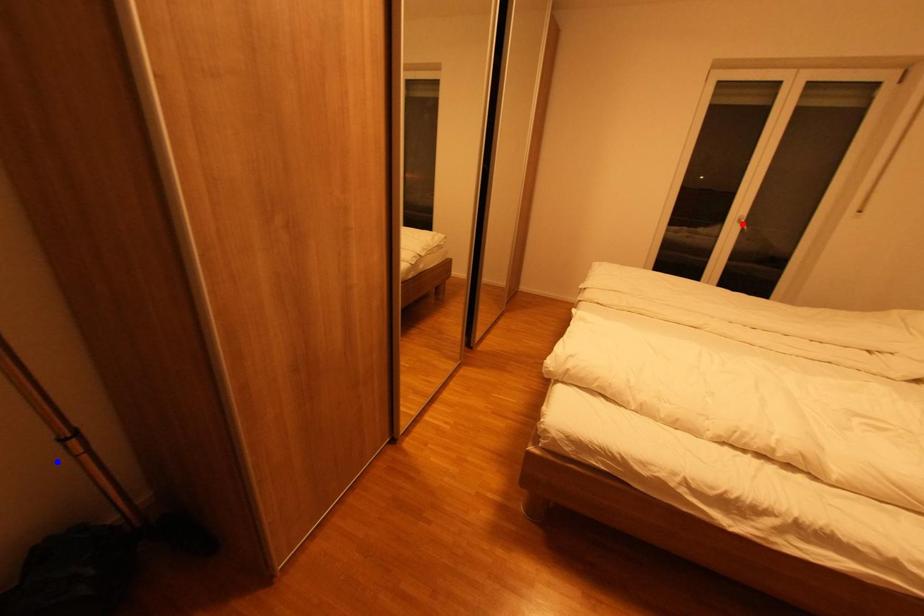
Question: Two points are marked on the image. Which point is closer to the camera?

Choices:
 (A) Blue point is closer.
 (B) Red point is closer.

Answer: (A)